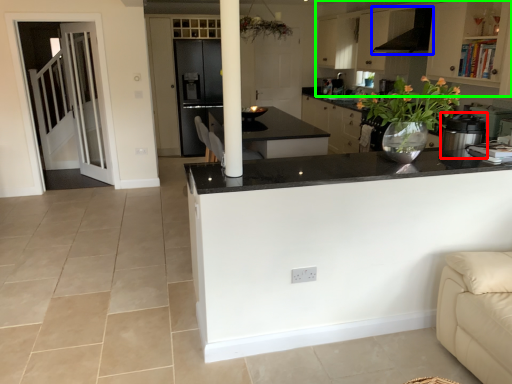
Question: Which object is positioned farthest from kitchen appliance (highlighted by a red box)? Select from exhaust hood (highlighted by a blue box) and cabinetry (highlighted by a green box).

Choices:
 (A) exhaust hood
 (B) cabinetry

Answer: (B)